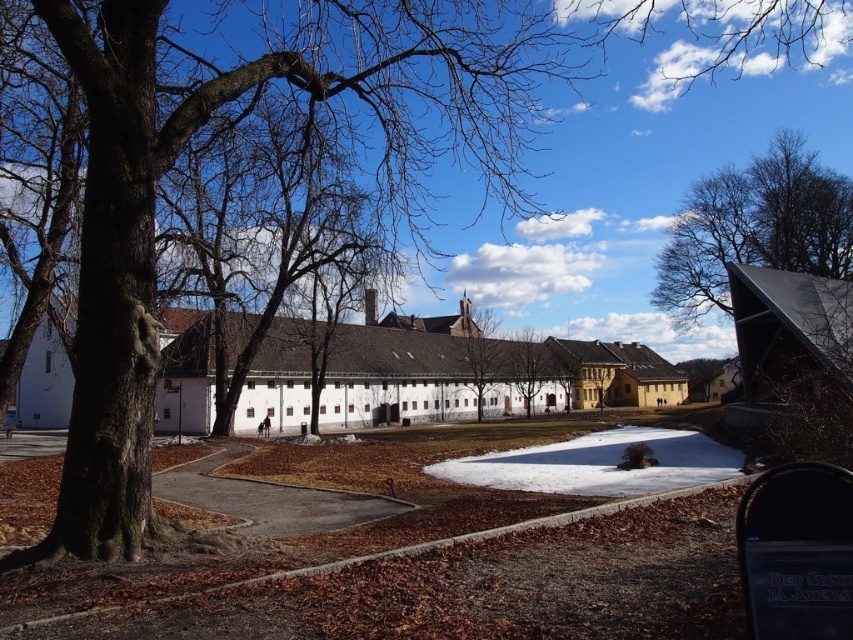
Question: Is white matte building at center closer to camera compared to brown textured tree at center?

Choices:
 (A) yes
 (B) no

Answer: (A)

Question: Which of these objects is positioned farthest from the brown textured tree at center?

Choices:
 (A) white matte building at center
 (B) brown bark tree at center

Answer: (A)

Question: In this image, where is bare branches at upper right located relative to brown textured tree at center?

Choices:
 (A) right
 (B) left

Answer: (A)

Question: Is white matte building at center further to camera compared to bare branches at upper right?

Choices:
 (A) no
 (B) yes

Answer: (A)

Question: Which of the following is the closest to the observer?

Choices:
 (A) (759, 195)
 (B) (483, 323)

Answer: (A)

Question: Which object is the farthest from the brown textured tree at center?

Choices:
 (A) white matte building at center
 (B) bare branches at upper right
 (C) brown bark tree at center

Answer: (B)